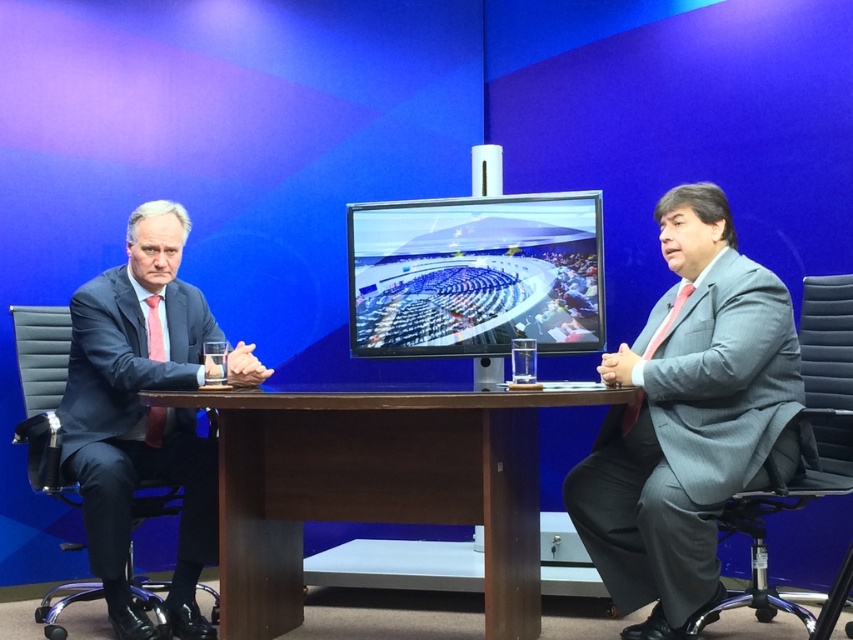
You are a photographer setting up for a portrait session. You need to position a light source above the gray fabric swivel chair at right to highlight the subject sitting there. However, the light must not cast a shadow on the brown wood table at center. Based on the scene description, is this possible?

The brown wood table at center is below the gray fabric swivel chair at right. Since the table is positioned lower than the chair, placing the light above the chair would cast a shadow downward towards the table. This means the shadow would likely fall on the brown wood table at center, making it impossible to avoid casting a shadow on the table while lighting the chair from above.

You are a photographer standing at the center of the studio. You want to take a photo of the gray textured suit at right. Where should you aim your camera to capture it?

You should aim your camera at point 0.656 on the x axis and 0.809 on the y axis to capture the gray textured suit at right.

You are a photographer setting up for a portrait session in the studio. The subjects will be seated on the gray fabric swivel chair at right and around the brown wood table at center. To ensure both subjects are at eye level with the camera, which object should you adjust the camera height to match?

The brown wood table at center has a lesser height compared to the gray fabric swivel chair at right. Therefore, you should adjust the camera height to match the height of the brown wood table at center to ensure both subjects are at eye level.